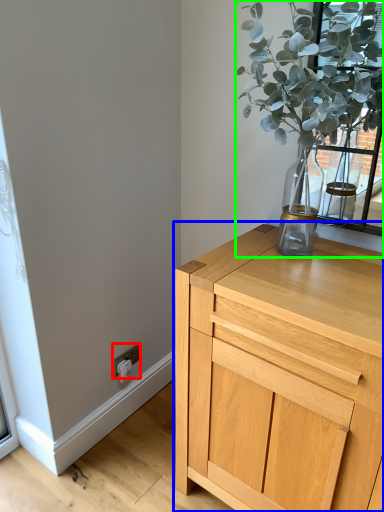
Question: Which is nearer to the electric outlet (highlighted by a red box)? chest of drawers (highlighted by a blue box) or houseplant (highlighted by a green box).

Choices:
 (A) chest of drawers
 (B) houseplant

Answer: (A)